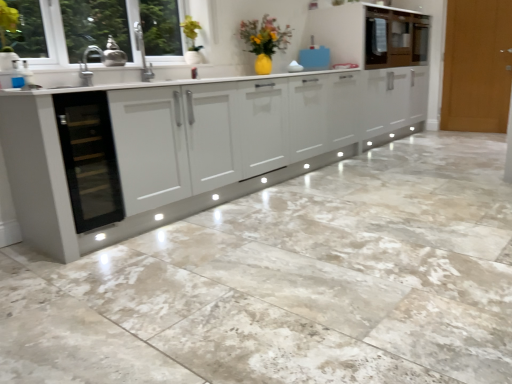
Question: Does transparent glass wine cooler at left appear on the right side of light brown wooden door at right?

Choices:
 (A) no
 (B) yes

Answer: (A)

Question: Is transparent glass wine cooler at left outside light brown wooden door at right?

Choices:
 (A) no
 (B) yes

Answer: (B)

Question: Does transparent glass wine cooler at left touch light brown wooden door at right?

Choices:
 (A) yes
 (B) no

Answer: (B)

Question: Does transparent glass wine cooler at left have a greater height compared to light brown wooden door at right?

Choices:
 (A) no
 (B) yes

Answer: (A)

Question: From the image's perspective, is transparent glass wine cooler at left above light brown wooden door at right?

Choices:
 (A) yes
 (B) no

Answer: (B)

Question: From their relative heights in the image, would you say metallic brass teapot at upper left, the 2th appliance positioned from the top, is taller or shorter than transparent glass wine cooler at left?

Choices:
 (A) tall
 (B) short

Answer: (B)

Question: Considering the positions of point (105, 62) and point (103, 150), is point (105, 62) closer or farther from the camera than point (103, 150)?

Choices:
 (A) farther
 (B) closer

Answer: (A)

Question: Looking at the image, does metallic brass teapot at upper left, which is the first appliance in left-to-right order, seem bigger or smaller compared to transparent glass wine cooler at left?

Choices:
 (A) small
 (B) big

Answer: (A)

Question: From the image's perspective, is metallic brass teapot at upper left, the 2th appliance positioned from the top, above or below transparent glass wine cooler at left?

Choices:
 (A) below
 (B) above

Answer: (B)

Question: In terms of size, does blue plastic bag at upper center, arranged as the 1th appliance when viewed from the back, appear bigger or smaller than metallic brass teapot at upper left, which is the first appliance in front-to-back order?

Choices:
 (A) big
 (B) small

Answer: (A)

Question: Would you say blue plastic bag at upper center, the 2th appliance in the bottom-to-top sequence, is to the left or to the right of metallic brass teapot at upper left, which is the 1th appliance in bottom-to-top order, in the picture?

Choices:
 (A) left
 (B) right

Answer: (B)

Question: Looking at their shapes, would you say blue plastic bag at upper center, the 2th appliance in the bottom-to-top sequence, is wider or thinner than metallic brass teapot at upper left, the 2th appliance positioned from the top?

Choices:
 (A) thin
 (B) wide

Answer: (B)

Question: In the image, is blue plastic bag at upper center, the 2th appliance in the bottom-to-top sequence, positioned in front of or behind metallic brass teapot at upper left, the second appliance when ordered from right to left?

Choices:
 (A) front
 (B) behind

Answer: (B)

Question: Is light brown wooden door at right bigger or smaller than glossy white cabinet at upper right, which is the second cabinetry in left-to-right order?

Choices:
 (A) big
 (B) small

Answer: (B)

Question: Which is correct: light brown wooden door at right is inside glossy white cabinet at upper right, which ranks as the 1th cabinetry in right-to-left order, or outside of it?

Choices:
 (A) inside
 (B) outside

Answer: (B)